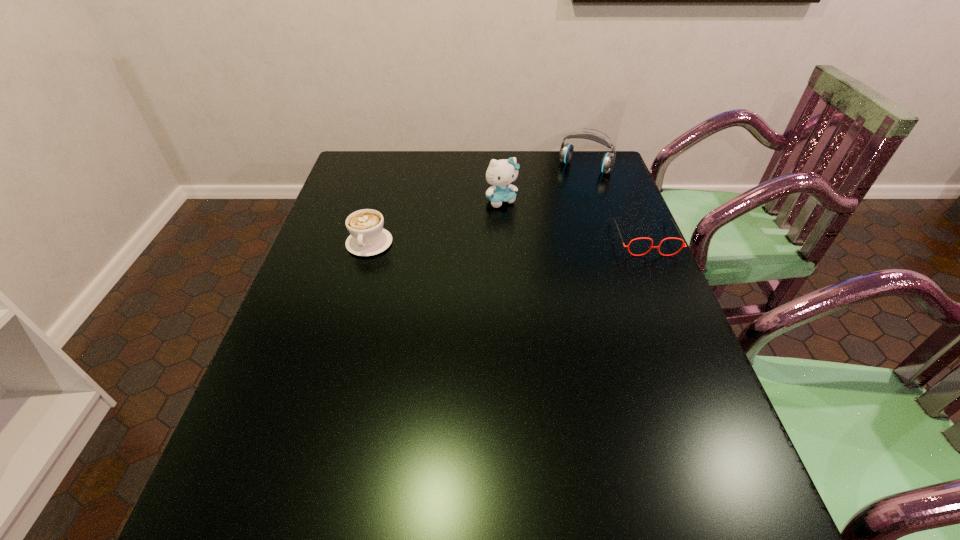
Where is `vacant area at the near edge`? vacant area at the near edge is located at coordinates (595, 465).

This screenshot has width=960, height=540. In order to click on free space at the left edge of the desktop in this screenshot , I will do `click(326, 321)`.

Identify the location of vacant space at the right edge of the desktop. The height and width of the screenshot is (540, 960). (626, 228).

What are the coordinates of `free space at the far left corner` in the screenshot? It's located at (381, 184).

In the image, there is a desktop. In order to click on free space at the near left corner in this screenshot , I will do `click(264, 455)`.

Where is `vacant region at the far right corner`? The image size is (960, 540). vacant region at the far right corner is located at coordinates (598, 154).

Where is `free spot between the cappuccino and the third nearest object`? Image resolution: width=960 pixels, height=540 pixels. free spot between the cappuccino and the third nearest object is located at coordinates point(436,222).

The height and width of the screenshot is (540, 960). Find the location of `vacant area that lies between the farthest object and the second farthest object`. vacant area that lies between the farthest object and the second farthest object is located at coordinates (543, 184).

At what (x,y) coordinates should I click in order to perform the action: click on empty space between the spectacles and the farthest object. Please return your answer as a coordinate pair (x, y). The height and width of the screenshot is (540, 960). Looking at the image, I should click on (614, 202).

Where is `empty space that is in between the shortest object and the cappuccino`? Image resolution: width=960 pixels, height=540 pixels. empty space that is in between the shortest object and the cappuccino is located at coordinates (507, 241).